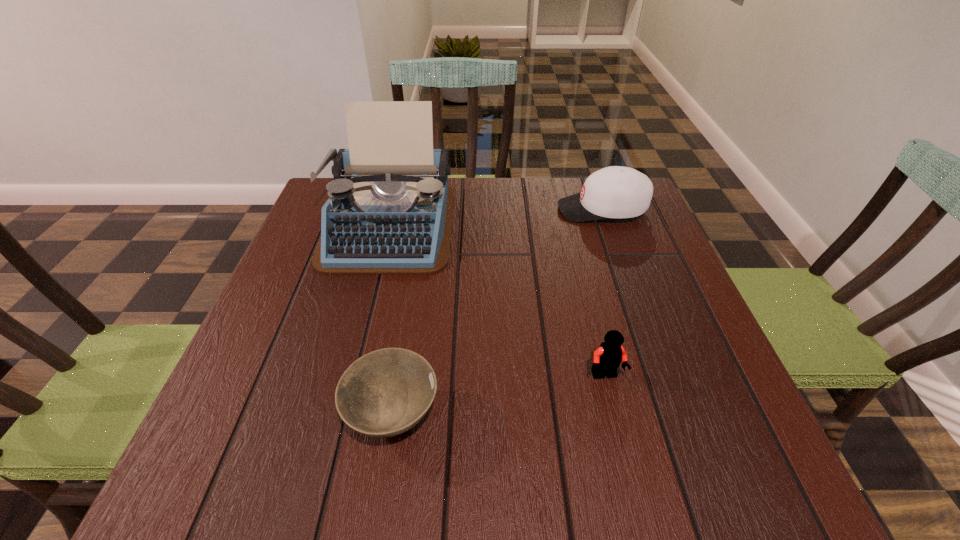
This screenshot has width=960, height=540. Find the location of `free point between the Lego and the baseball cap`. free point between the Lego and the baseball cap is located at coordinates (604, 293).

The height and width of the screenshot is (540, 960). Identify the location of the third closest object to the baseball cap. (386, 392).

Identify the location of the third closest object relative to the typewriter. (607, 358).

Locate an element on the screen. The width and height of the screenshot is (960, 540). vacant space that satisfies the following two spatial constraints: 1. on the front-facing side of the baseball cap; 2. on the front side of the bowl is located at coordinates (675, 415).

Find the location of a particular element. Image resolution: width=960 pixels, height=540 pixels. vacant space that satisfies the following two spatial constraints: 1. on the typing side of the tallest object; 2. on the left side of the shortest object is located at coordinates (340, 415).

I want to click on vacant area that satisfies the following two spatial constraints: 1. on the front-facing side of the baseball cap; 2. on the typing side of the tallest object, so click(607, 224).

Locate an element on the screen. This screenshot has height=540, width=960. free space that satisfies the following two spatial constraints: 1. on the front-facing side of the baseball cap; 2. on the front side of the shortest object is located at coordinates (675, 415).